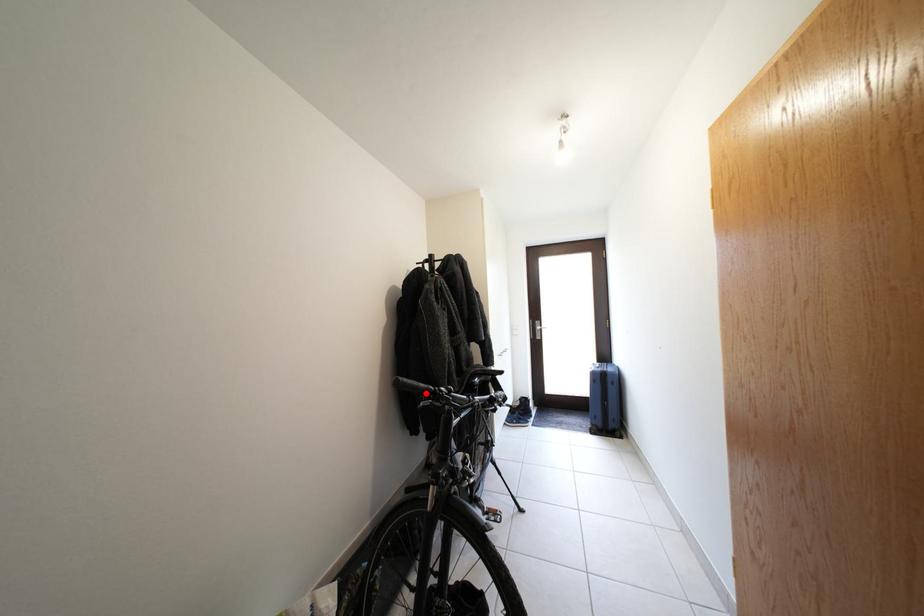
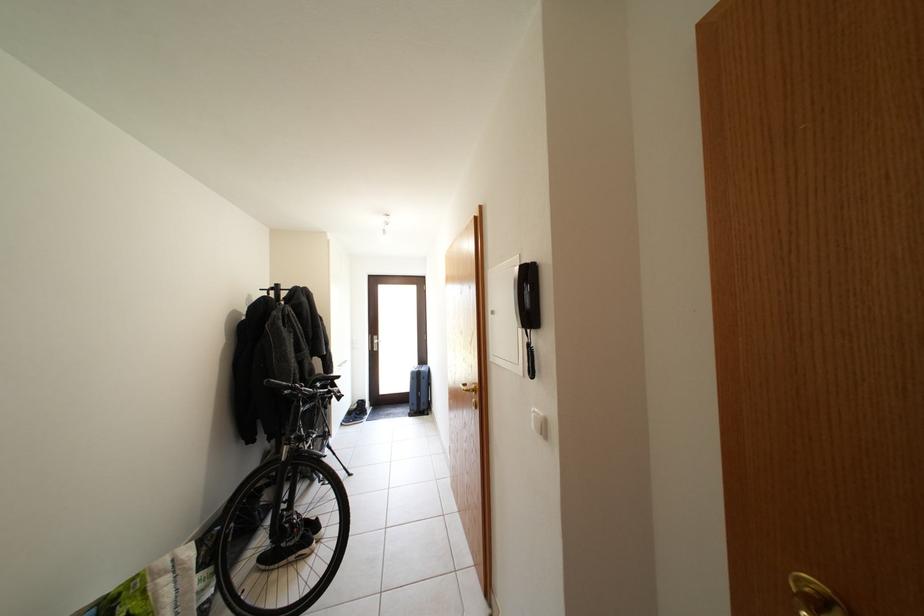
The point at the highlighted location is marked in the first image. Where is the corresponding point in the second image?

(289, 390)